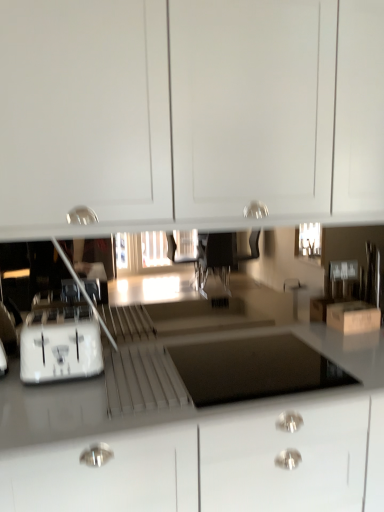
The height and width of the screenshot is (512, 384). I want to click on free point above white glossy countertop at lower center (from a real-world perspective), so click(x=199, y=388).